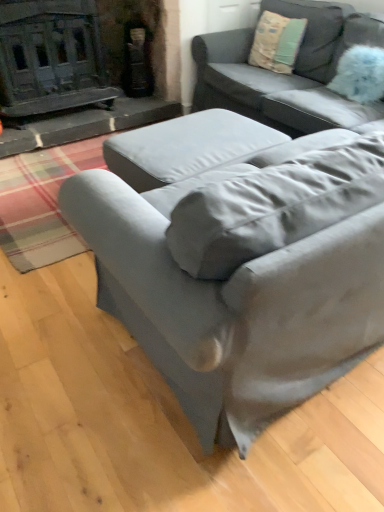
Question: Is satin gray couch at center, positioned as the first studio couch in back-to-front order, to the right of satin gray couch at lower right, which is the 1th studio couch from front to back, from the viewer's perspective?

Choices:
 (A) no
 (B) yes

Answer: (B)

Question: Considering the relative positions of satin gray couch at center, the second studio couch when ordered from front to back, and satin gray couch at lower right, which is counted as the 2th studio couch, starting from the back, in the image provided, is satin gray couch at center, the second studio couch when ordered from front to back, in front of satin gray couch at lower right, which is counted as the 2th studio couch, starting from the back,?

Choices:
 (A) no
 (B) yes

Answer: (A)

Question: From the image's perspective, does satin gray couch at center, the second studio couch when ordered from front to back, appear lower than satin gray couch at lower right, which is counted as the 2th studio couch, starting from the back?

Choices:
 (A) no
 (B) yes

Answer: (A)

Question: Considering the relative sizes of satin gray couch at center, the second studio couch when ordered from front to back, and satin gray couch at lower right, which is the 1th studio couch from front to back, in the image provided, is satin gray couch at center, the second studio couch when ordered from front to back, thinner than satin gray couch at lower right, which is the 1th studio couch from front to back,?

Choices:
 (A) yes
 (B) no

Answer: (A)

Question: Would you consider satin gray couch at center, the second studio couch when ordered from front to back, to be distant from satin gray couch at lower right, which is counted as the 2th studio couch, starting from the back?

Choices:
 (A) no
 (B) yes

Answer: (B)

Question: From a real-world perspective, is satin gray couch at center, positioned as the first studio couch in back-to-front order, on satin gray couch at lower right, which is counted as the 2th studio couch, starting from the back?

Choices:
 (A) yes
 (B) no

Answer: (A)

Question: Can you confirm if blue fluffy pillow at upper right is smaller than satin gray couch at center, the second studio couch when ordered from front to back?

Choices:
 (A) no
 (B) yes

Answer: (B)

Question: Does blue fluffy pillow at upper right appear on the left side of satin gray couch at center, the second studio couch when ordered from front to back?

Choices:
 (A) no
 (B) yes

Answer: (A)

Question: Is blue fluffy pillow at upper right shorter than satin gray couch at center, positioned as the first studio couch in back-to-front order?

Choices:
 (A) yes
 (B) no

Answer: (A)

Question: Is blue fluffy pillow at upper right in front of satin gray couch at center, the second studio couch when ordered from front to back?

Choices:
 (A) yes
 (B) no

Answer: (B)

Question: Is blue fluffy pillow at upper right facing away from satin gray couch at center, the second studio couch when ordered from front to back?

Choices:
 (A) no
 (B) yes

Answer: (B)

Question: Considering the relative positions of blue fluffy pillow at upper right and satin gray couch at center, the second studio couch when ordered from front to back, in the image provided, is blue fluffy pillow at upper right behind satin gray couch at center, the second studio couch when ordered from front to back,?

Choices:
 (A) no
 (B) yes

Answer: (B)

Question: Is blue fluffy pillow at upper right behind satin gray couch at lower right, which is the 1th studio couch from front to back?

Choices:
 (A) yes
 (B) no

Answer: (A)